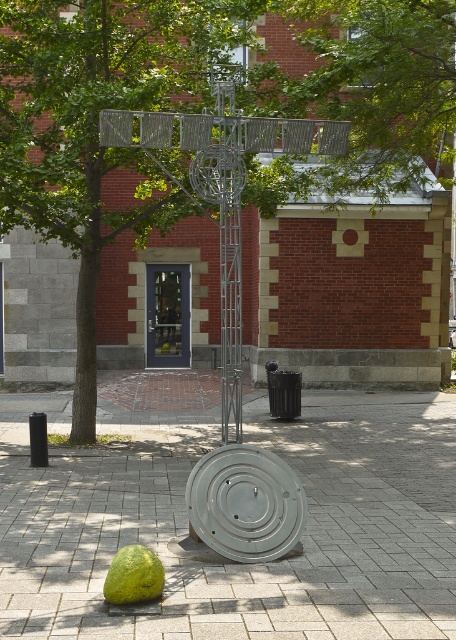
You are a city planner assessing the sculpture garden. You need to install a new bench between the green leafy tree at center and the green leafy tree at upper center. What is the minimum distance the bench should be placed from each tree to ensure it fits between them?

The green leafy tree at center and green leafy tree at upper center are 1.02 meters apart. To fit the bench between them, the minimum distance from each tree should be at least half of the total distance, so approximately 0.51 meters from each tree.

You are standing in the urban setting and want to take a photo of the white concrete pavement at center and the green leafy tree at center. Which object is closer to the ground?

The white concrete pavement at center is closer to the ground as it is positioned below the green leafy tree at center.

You are standing in front of the sculpture and want to take a photo. There are two points marked on the sculpture, one at coordinate point [40,506] and another at point [332,74]. Which point will appear larger in your photo?

Point [40,506] is closer to the camera than point [332,74], so it will appear larger in the photo.